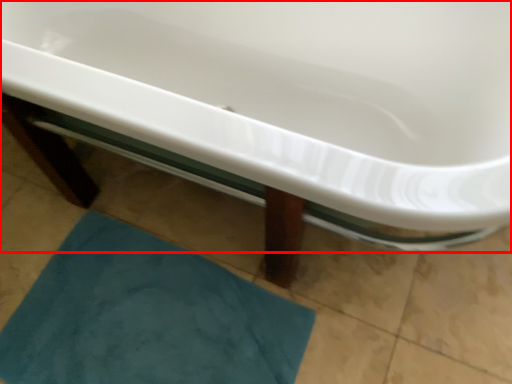
Question: Observing the image, what is the correct spatial positioning of bathtub (annotated by the red box) in reference to bath mat?

Choices:
 (A) left
 (B) right

Answer: (B)